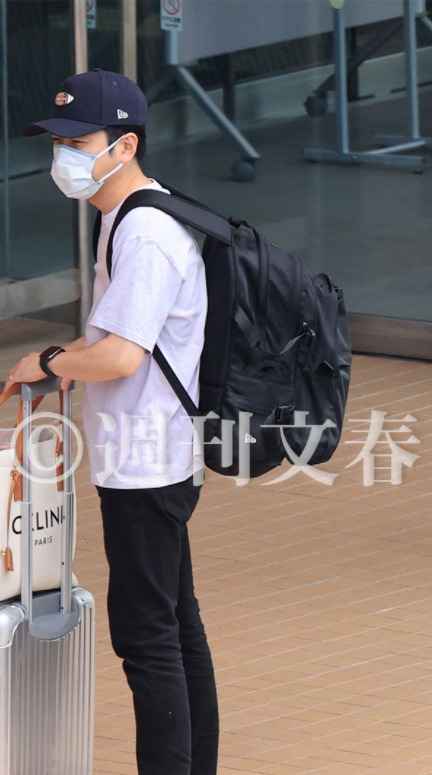
Where is `tile`? This screenshot has width=432, height=775. tile is located at coordinates (311, 703).